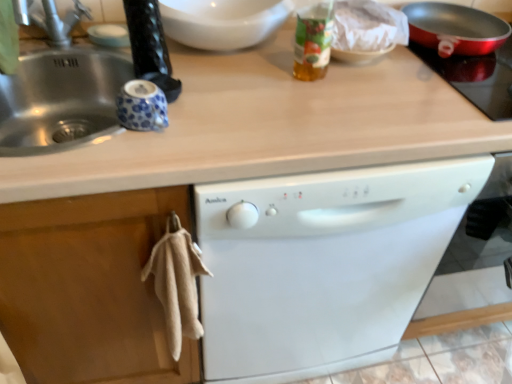
Where is `metallic red pan at upper right`? The width and height of the screenshot is (512, 384). metallic red pan at upper right is located at coordinates (477, 77).

Where is `translucent plastic bottle at upper center`? translucent plastic bottle at upper center is located at coordinates (313, 41).

Locate an element on the screen. The image size is (512, 384). white glossy dishwasher at center is located at coordinates (323, 264).

Is silver metallic faucet at upper left positioned with its back to white glossy bowl at upper center?

No, white glossy bowl at upper center is not at the back of silver metallic faucet at upper left.

At what (x,y) coordinates should I click in order to perform the action: click on mixing bowl directly beneath the silver metallic faucet at upper left (from a real-world perspective). Please return your answer as a coordinate pair (x, y). Image resolution: width=512 pixels, height=384 pixels. Looking at the image, I should click on (222, 21).

Can you confirm if silver metallic faucet at upper left is wider than white glossy bowl at upper center?

Correct, the width of silver metallic faucet at upper left exceeds that of white glossy bowl at upper center.

Are silver metallic faucet at upper left and white glossy bowl at upper center beside each other?

No, silver metallic faucet at upper left is not in contact with white glossy bowl at upper center.

Is translucent plastic bottle at upper center far from metallic red pan at upper right?

translucent plastic bottle at upper center is near metallic red pan at upper right, not far away.

Could you tell me if translucent plastic bottle at upper center is facing metallic red pan at upper right?

No.

In the scene shown: From the image's perspective, between translucent plastic bottle at upper center and metallic red pan at upper right, which one is located above?

translucent plastic bottle at upper center appears higher in the image.

Where is `bottle lying above the metallic red pan at upper right (from the image's perspective)`? bottle lying above the metallic red pan at upper right (from the image's perspective) is located at coordinates (313, 41).

From the image's perspective, who appears lower, white glossy bowl at upper center or white glossy dishwasher at center?

white glossy dishwasher at center, from the image's perspective.

Is white glossy bowl at upper center wider than white glossy dishwasher at center?

Incorrect, the width of white glossy bowl at upper center does not surpass that of white glossy dishwasher at center.

Is white glossy bowl at upper center positioned with its back to white glossy dishwasher at center?

No, white glossy dishwasher at center is not at the back of white glossy bowl at upper center.

What are the coordinates of `faucet located above the metallic red pan at upper right (from the image's perspective)` in the screenshot? It's located at (50, 19).

Are metallic red pan at upper right and silver metallic faucet at upper left far apart?

No, there isn't a large distance between metallic red pan at upper right and silver metallic faucet at upper left.

From the image's perspective, is metallic red pan at upper right on silver metallic faucet at upper left?

Actually, metallic red pan at upper right appears below silver metallic faucet at upper left in the image.

From a real-world perspective, between translucent plastic bottle at upper center and white glossy bowl at upper center, who is vertically higher?

translucent plastic bottle at upper center, from a real-world perspective.

Which object is closer to the camera, translucent plastic bottle at upper center or white glossy bowl at upper center?

translucent plastic bottle at upper center is closer to the camera.

Can you tell me how much translucent plastic bottle at upper center and white glossy bowl at upper center differ in facing direction?

The angular difference between translucent plastic bottle at upper center and white glossy bowl at upper center is 0.00124 degrees.

Between translucent plastic bottle at upper center and white glossy bowl at upper center, which one has smaller size?

translucent plastic bottle at upper center.

Identify the location of mixing bowl above the metallic red pan at upper right (from the image's perspective). (222, 21).

Between metallic red pan at upper right and white glossy bowl at upper center, which one appears on the right side from the viewer's perspective?

Positioned to the right is metallic red pan at upper right.

Which is less distant, (x=507, y=66) or (x=275, y=15)?

The point (x=275, y=15) is more forward.

Which point is more forward, (68, 41) or (380, 219)?

The point (380, 219) is more forward.

Considering the relative sizes of silver metallic faucet at upper left and white glossy dishwasher at center in the image provided, is silver metallic faucet at upper left smaller than white glossy dishwasher at center?

Indeed, silver metallic faucet at upper left has a smaller size compared to white glossy dishwasher at center.

Identify the location of dishwasher beneath the silver metallic faucet at upper left (from a real-world perspective). 323,264.

The width and height of the screenshot is (512, 384). In the image, there is a silver metallic faucet at upper left. Identify the location of mixing bowl below it (from a real-world perspective). (222, 21).

Locate an element on the screen. The image size is (512, 384). bottle above the metallic red pan at upper right (from a real-world perspective) is located at coordinates (313, 41).

Based on their spatial positions, is silver metallic faucet at upper left or white glossy bowl at upper center further from translucent plastic bottle at upper center?

silver metallic faucet at upper left is further to translucent plastic bottle at upper center.

From the image, which object appears to be farther from translucent plastic bottle at upper center, metallic red pan at upper right or silver metallic faucet at upper left?

silver metallic faucet at upper left lies further to translucent plastic bottle at upper center than the other object.

When comparing their distances from translucent plastic bottle at upper center, does metallic red pan at upper right or white glossy dishwasher at center seem closer?

metallic red pan at upper right lies closer to translucent plastic bottle at upper center than the other object.

Which object lies further to the anchor point metallic red pan at upper right, white glossy dishwasher at center or silver metallic faucet at upper left?

silver metallic faucet at upper left.

Considering their positions, is silver metallic faucet at upper left positioned closer to metallic red pan at upper right than white glossy bowl at upper center?

Among the two, white glossy bowl at upper center is located nearer to metallic red pan at upper right.

In the scene shown: When comparing their distances from translucent plastic bottle at upper center, does white glossy dishwasher at center or metallic red pan at upper right seem further?

white glossy dishwasher at center lies further to translucent plastic bottle at upper center than the other object.

Looking at this image, looking at the image, which one is located closer to translucent plastic bottle at upper center, white glossy bowl at upper center or silver metallic faucet at upper left?

white glossy bowl at upper center.

Based on their spatial positions, is silver metallic faucet at upper left or translucent plastic bottle at upper center closer to metallic red pan at upper right?

translucent plastic bottle at upper center.

In order to click on dishwasher between silver metallic faucet at upper left and metallic red pan at upper right from left to right in this screenshot , I will do `click(323, 264)`.

The height and width of the screenshot is (384, 512). What are the coordinates of `dishwasher situated between white glossy bowl at upper center and metallic red pan at upper right from left to right` in the screenshot? It's located at (323, 264).

Locate an element on the screen. Image resolution: width=512 pixels, height=384 pixels. dishwasher located between silver metallic faucet at upper left and translucent plastic bottle at upper center in the left-right direction is located at coordinates (323, 264).

The width and height of the screenshot is (512, 384). In order to click on faucet that lies between white glossy bowl at upper center and white glossy dishwasher at center from top to bottom in this screenshot , I will do `click(50, 19)`.